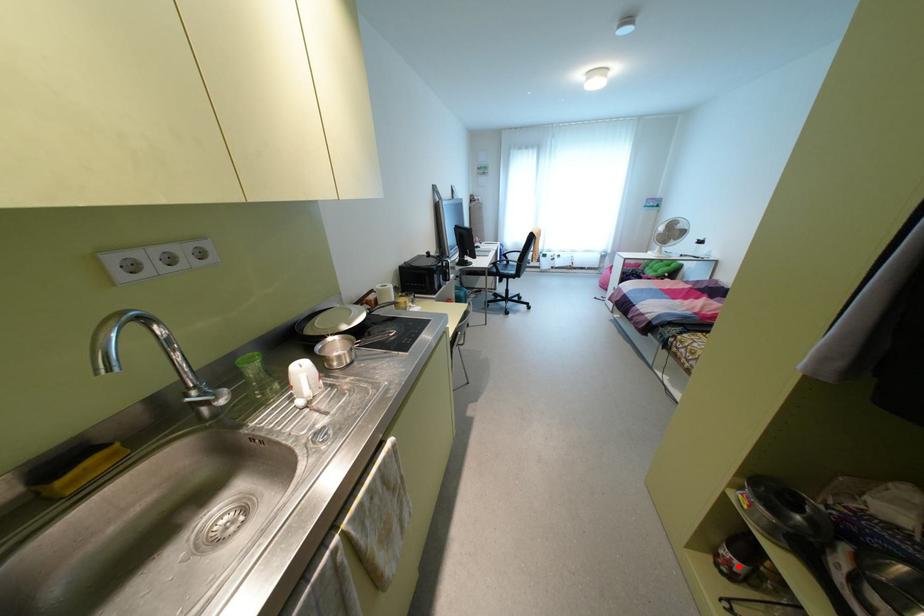
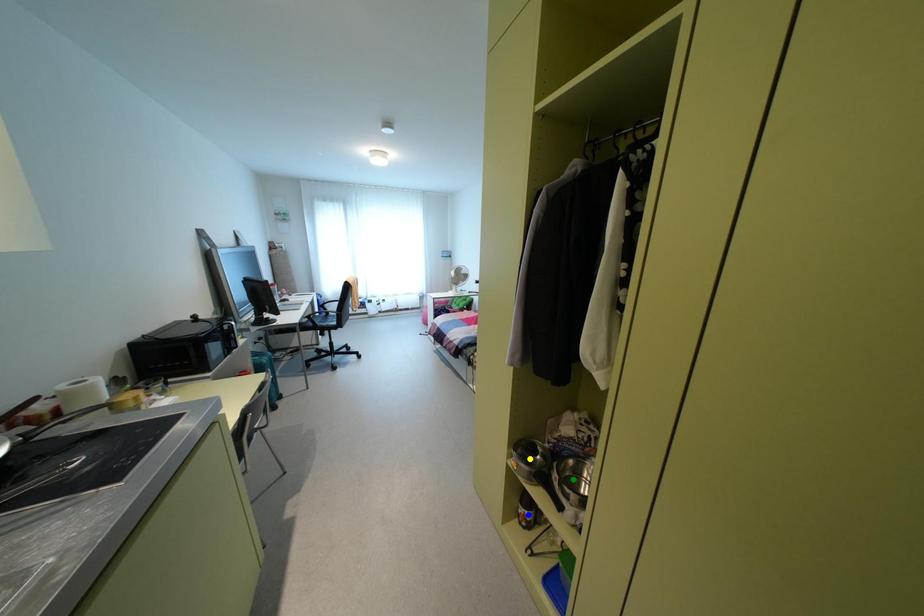
Question: I am providing you with two images of the same scene from different viewpoints. A red point is marked on the first image. You are given multiple points on the second image. Can you choose the point in image 2 that corresponds to the point in image 1?

Choices:
 (A) green point
 (B) yellow point
 (C) blue point

Answer: (C)